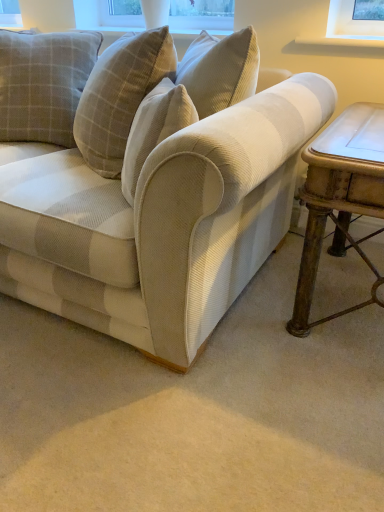
The width and height of the screenshot is (384, 512). In order to click on beige corduroy couch at center in this screenshot , I will do `click(162, 206)`.

How different are the orientations of plaid fabric pillow at upper left and beige corduroy couch at center in degrees?

The angular difference between plaid fabric pillow at upper left and beige corduroy couch at center is 32.1 degrees.

Does plaid fabric pillow at upper left have a smaller size compared to beige corduroy couch at center?

Correct, plaid fabric pillow at upper left occupies less space than beige corduroy couch at center.

Image resolution: width=384 pixels, height=512 pixels. I want to click on studio couch below the plaid fabric pillow at upper left (from the image's perspective), so click(162, 206).

Is the depth of plaid fabric pillow at upper left less than that of beige corduroy couch at center?

No, plaid fabric pillow at upper left is further to the viewer.

Which object is thinner, plaid fabric pillow at upper left or rustic wood table at right?

plaid fabric pillow at upper left.

Who is bigger, plaid fabric pillow at upper left or rustic wood table at right?

rustic wood table at right.

From the image's perspective, which is above, plaid fabric pillow at upper left or rustic wood table at right?

plaid fabric pillow at upper left appears higher in the image.

Is the depth of beige corduroy couch at center less than that of rustic wood table at right?

Yes, it is in front of rustic wood table at right.

From a real-world perspective, between beige corduroy couch at center and rustic wood table at right, who is vertically higher?

beige corduroy couch at center is physically above.

From the image's perspective, between beige corduroy couch at center and rustic wood table at right, who is located below?

rustic wood table at right, from the image's perspective.

Considering the relative sizes of beige corduroy couch at center and rustic wood table at right in the image provided, is beige corduroy couch at center smaller than rustic wood table at right?

Incorrect, beige corduroy couch at center is not smaller in size than rustic wood table at right.

Considering the sizes of objects rustic wood table at right and plaid fabric pillow at upper left in the image provided, who is smaller, rustic wood table at right or plaid fabric pillow at upper left?

With smaller size is plaid fabric pillow at upper left.

Is plaid fabric pillow at upper left inside rustic wood table at right?

No, plaid fabric pillow at upper left is not surrounded by rustic wood table at right.

Considering the relative positions of rustic wood table at right and plaid fabric pillow at upper left in the image provided, is rustic wood table at right to the left or to the right of plaid fabric pillow at upper left?

In the image, rustic wood table at right appears on the right side of plaid fabric pillow at upper left.

Based on the photo, can you confirm if beige corduroy couch at center is bigger than plaid fabric pillow at upper left?

Yes.

Does beige corduroy couch at center turn towards plaid fabric pillow at upper left?

Yes, beige corduroy couch at center is turned towards plaid fabric pillow at upper left.

Is point (278, 128) more distant than point (24, 95)?

No, (278, 128) is closer to viewer.

Is beige corduroy couch at center positioned far away from plaid fabric pillow at upper left?

No, there isn't a large distance between beige corduroy couch at center and plaid fabric pillow at upper left.

Which is more to the left, rustic wood table at right or beige corduroy couch at center?

beige corduroy couch at center.

Considering the sizes of rustic wood table at right and beige corduroy couch at center in the image, is rustic wood table at right taller or shorter than beige corduroy couch at center?

Considering their sizes, rustic wood table at right has less height than beige corduroy couch at center.

In terms of size, does rustic wood table at right appear bigger or smaller than beige corduroy couch at center?

Considering their sizes, rustic wood table at right takes up less space than beige corduroy couch at center.

Consider the image. Which of these two, rustic wood table at right or beige corduroy couch at center, is wider?

beige corduroy couch at center.

Locate an element on the screen. studio couch below the plaid fabric pillow at upper left (from the image's perspective) is located at coordinates (162, 206).

Where is `pillow on the left side of rustic wood table at right`? This screenshot has height=512, width=384. pillow on the left side of rustic wood table at right is located at coordinates (43, 84).

Considering their positions, is beige corduroy couch at center positioned closer to rustic wood table at right than plaid fabric pillow at upper left?

beige corduroy couch at center.

When comparing their distances from beige corduroy couch at center, does rustic wood table at right or plaid fabric pillow at upper left seem further?

plaid fabric pillow at upper left is positioned further to the anchor beige corduroy couch at center.

Based on their spatial positions, is plaid fabric pillow at upper left or rustic wood table at right further from beige corduroy couch at center?

The object further to beige corduroy couch at center is plaid fabric pillow at upper left.

Based on their spatial positions, is plaid fabric pillow at upper left or beige corduroy couch at center further from rustic wood table at right?

Among the two, plaid fabric pillow at upper left is located further to rustic wood table at right.

Looking at the image, which one is located closer to plaid fabric pillow at upper left, rustic wood table at right or beige corduroy couch at center?

Based on the image, beige corduroy couch at center appears to be nearer to plaid fabric pillow at upper left.

When comparing their distances from plaid fabric pillow at upper left, does beige corduroy couch at center or rustic wood table at right seem closer?

The object closer to plaid fabric pillow at upper left is beige corduroy couch at center.

Identify the location of studio couch between plaid fabric pillow at upper left and rustic wood table at right from left to right. (162, 206).